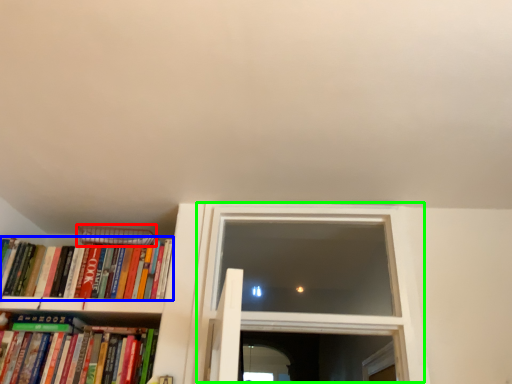
Question: Estimate the real-world distances between objects in this image. Which object is farther from paperback book (highlighted by a red box), book (highlighted by a blue box) or window (highlighted by a green box)?

Choices:
 (A) book
 (B) window

Answer: (B)